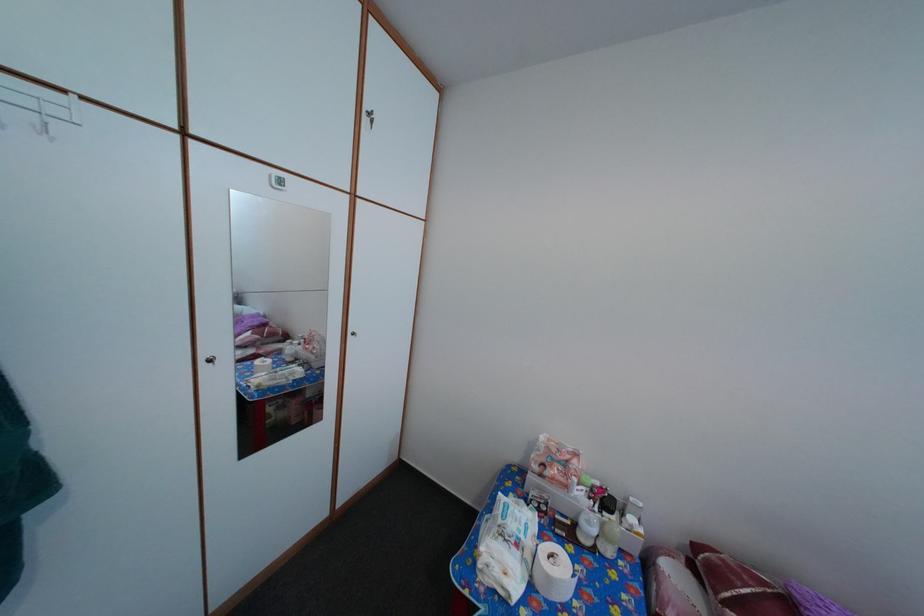
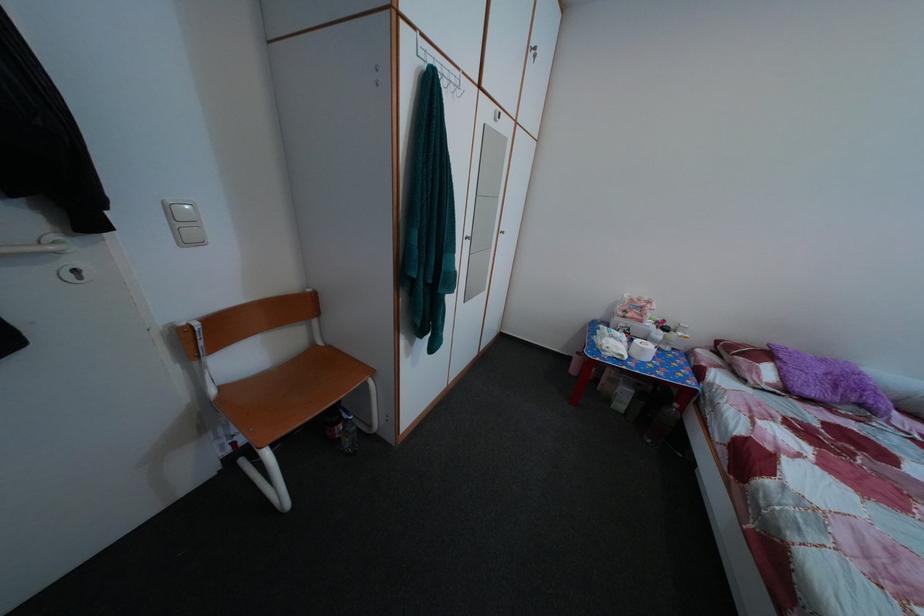
In a continuous first-person perspective shot, in which direction is the camera moving?

The cameraman walked toward left, backward.